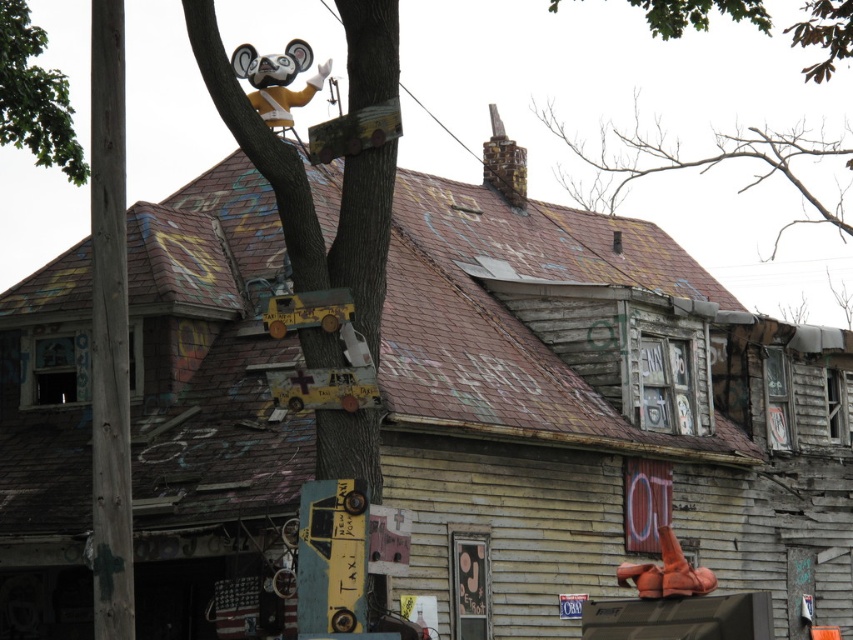
You are standing in front of the dilapidated building and notice the wooden tree trunk at upper center. Can you determine its position relative to the building?

The wooden tree trunk at upper center is located at point (308, 189), which places it in front of the building, partially obscuring the roofline.

You are a drone operator trying to navigate between two points in the image. The first point is point [370,230] and the second is point [786,132]. Since you need to avoid the tree trunk blocking the path, which point should you start your flight from to ensure a clear path towards the other point?

You should start from point [370,230] because it is in front of point [786,132]. Since the tree trunk is blocking the path, starting from the point in front allows you to navigate around the obstruction more easily.

You are a bird looking for a place to perch. You see a brown bark tree at upper center and a green leafy tree at upper center. Which tree is closer to the building depicted in the scene?

The brown bark tree at upper center and green leafy tree at upper center are 15.54 meters apart from each other, so it is unclear which one is closer to the building without additional information about their positions relative to the building.